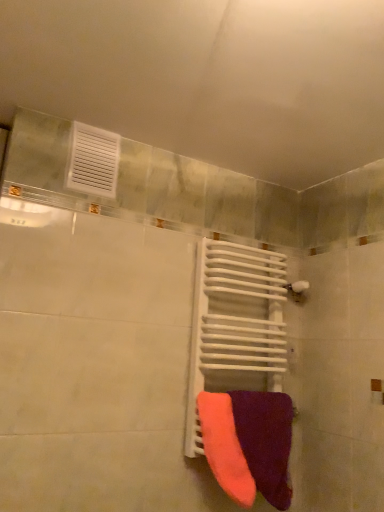
Measure the distance between point [252,412] and camera.

Point [252,412] is 1.46 meters from camera.

This screenshot has height=512, width=384. Find the location of `neon orange fabric towel at center, which is the first towel from left to right`. neon orange fabric towel at center, which is the first towel from left to right is located at coordinates point(224,447).

Locate an element on the screen. This screenshot has height=512, width=384. white metallic radiator at center is located at coordinates (235, 326).

Would you say velvet purple towel at lower right, which is the 2th towel from left to right, is to the left or to the right of white metallic radiator at center in the picture?

velvet purple towel at lower right, which is the 2th towel from left to right, is positioned on white metallic radiator at center's right side.

Considering the relative sizes of velvet purple towel at lower right, arranged as the 1th towel when viewed from the right, and white metallic radiator at center in the image provided, is velvet purple towel at lower right, arranged as the 1th towel when viewed from the right, taller than white metallic radiator at center?

In fact, velvet purple towel at lower right, arranged as the 1th towel when viewed from the right, may be shorter than white metallic radiator at center.

Find the location of `radiator located on the left of velvet purple towel at lower right, which is the 2th towel from left to right`. radiator located on the left of velvet purple towel at lower right, which is the 2th towel from left to right is located at coordinates coord(235,326).

Are velvet purple towel at lower right, arranged as the 1th towel when viewed from the right, and white metallic radiator at center making contact?

No, velvet purple towel at lower right, arranged as the 1th towel when viewed from the right, is not next to white metallic radiator at center.

Considering the positions of points (200, 381) and (253, 408), is point (200, 381) farther from camera compared to point (253, 408)?

Yes, it is.

Is white metallic radiator at center far away from velvet purple towel at lower right, arranged as the 1th towel when viewed from the right?

That's not correct — white metallic radiator at center is a little close to velvet purple towel at lower right, arranged as the 1th towel when viewed from the right.

Between white metallic radiator at center and velvet purple towel at lower right, which is the 2th towel from left to right, which one is positioned in front?

velvet purple towel at lower right, which is the 2th towel from left to right, is closer to the camera.

Can you confirm if white metallic radiator at center is taller than velvet purple towel at lower right, which is the 2th towel from left to right?

Yes, white metallic radiator at center is taller than velvet purple towel at lower right, which is the 2th towel from left to right.

Is white metallic radiator at center further to the viewer compared to neon orange fabric towel at center, which is the first towel from left to right?

Yes, white metallic radiator at center is behind neon orange fabric towel at center, which is the first towel from left to right.

Could you tell me if white metallic radiator at center is facing neon orange fabric towel at center, which is the second towel from right to left?

Yes.

In order to click on towel above the velvet purple towel at lower right, arranged as the 1th towel when viewed from the right (from the image's perspective) in this screenshot , I will do `click(224, 447)`.

From the picture: From the image's perspective, between velvet purple towel at lower right, which is the 2th towel from left to right, and neon orange fabric towel at center, which is the second towel from right to left, who is located below?

velvet purple towel at lower right, which is the 2th towel from left to right.

From a real-world perspective, is velvet purple towel at lower right, which is the 2th towel from left to right, below neon orange fabric towel at center, which is the second towel from right to left?

Yes.

Which object is positioned more to the left, velvet purple towel at lower right, arranged as the 1th towel when viewed from the right, or neon orange fabric towel at center, which is the second towel from right to left?

neon orange fabric towel at center, which is the second towel from right to left, is more to the left.

Which object is closer to the camera taking this photo, neon orange fabric towel at center, which is the first towel from left to right, or white metallic radiator at center?

neon orange fabric towel at center, which is the first towel from left to right, is closer to the camera.

Is neon orange fabric towel at center, which is the first towel from left to right, facing away from white metallic radiator at center?

Correct, neon orange fabric towel at center, which is the first towel from left to right, is looking away from white metallic radiator at center.

Between neon orange fabric towel at center, which is the second towel from right to left, and white metallic radiator at center, which one has smaller size?

With smaller size is neon orange fabric towel at center, which is the second towel from right to left.

In terms of height, does neon orange fabric towel at center, which is the first towel from left to right, look taller or shorter compared to velvet purple towel at lower right, arranged as the 1th towel when viewed from the right?

In the image, neon orange fabric towel at center, which is the first towel from left to right, appears to be shorter than velvet purple towel at lower right, arranged as the 1th towel when viewed from the right.

From the image's perspective, is neon orange fabric towel at center, which is the second towel from right to left, located above or below velvet purple towel at lower right, which is the 2th towel from left to right?

neon orange fabric towel at center, which is the second towel from right to left, is situated higher than velvet purple towel at lower right, which is the 2th towel from left to right, in the image.

Is neon orange fabric towel at center, which is the first towel from left to right, thinner than velvet purple towel at lower right, arranged as the 1th towel when viewed from the right?

Correct, the width of neon orange fabric towel at center, which is the first towel from left to right, is less than that of velvet purple towel at lower right, arranged as the 1th towel when viewed from the right.

Based on the photo, can we say neon orange fabric towel at center, which is the second towel from right to left, lies outside velvet purple towel at lower right, which is the 2th towel from left to right?

Yes, neon orange fabric towel at center, which is the second towel from right to left, is outside of velvet purple towel at lower right, which is the 2th towel from left to right.

Where is `radiator lying above the velvet purple towel at lower right, arranged as the 1th towel when viewed from the right (from the image's perspective)`? Image resolution: width=384 pixels, height=512 pixels. radiator lying above the velvet purple towel at lower right, arranged as the 1th towel when viewed from the right (from the image's perspective) is located at coordinates (235, 326).

This screenshot has width=384, height=512. Identify the location of the 2nd towel below the white metallic radiator at center (from a real-world perspective). (266, 441).

Looking at this image, when comparing their distances from velvet purple towel at lower right, arranged as the 1th towel when viewed from the right, does neon orange fabric towel at center, which is the first towel from left to right, or white metallic radiator at center seem further?

The object further to velvet purple towel at lower right, arranged as the 1th towel when viewed from the right, is white metallic radiator at center.

Based on their spatial positions, is velvet purple towel at lower right, arranged as the 1th towel when viewed from the right, or neon orange fabric towel at center, which is the first towel from left to right, closer to white metallic radiator at center?

Among the two, velvet purple towel at lower right, arranged as the 1th towel when viewed from the right, is located nearer to white metallic radiator at center.

Estimate the real-world distances between objects in this image. Which object is further from neon orange fabric towel at center, which is the second towel from right to left, velvet purple towel at lower right, which is the 2th towel from left to right, or white metallic radiator at center?

Based on the image, white metallic radiator at center appears to be further to neon orange fabric towel at center, which is the second towel from right to left.

Based on their spatial positions, is neon orange fabric towel at center, which is the first towel from left to right, or velvet purple towel at lower right, which is the 2th towel from left to right, closer to white metallic radiator at center?

Based on the image, velvet purple towel at lower right, which is the 2th towel from left to right, appears to be nearer to white metallic radiator at center.

From the image, which object appears to be nearer to neon orange fabric towel at center, which is the first towel from left to right, white metallic radiator at center or velvet purple towel at lower right, which is the 2th towel from left to right?

The object closer to neon orange fabric towel at center, which is the first towel from left to right, is velvet purple towel at lower right, which is the 2th towel from left to right.

Estimate the real-world distances between objects in this image. Which object is further from velvet purple towel at lower right, arranged as the 1th towel when viewed from the right, white metallic radiator at center or neon orange fabric towel at center, which is the first towel from left to right?

white metallic radiator at center lies further to velvet purple towel at lower right, arranged as the 1th towel when viewed from the right, than the other object.

I want to click on towel between white metallic radiator at center and velvet purple towel at lower right, which is the 2th towel from left to right, in the up-down direction, so click(x=224, y=447).